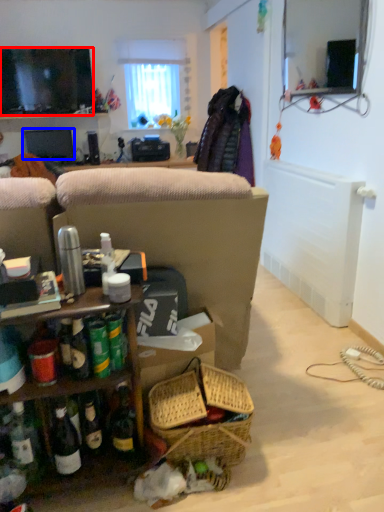
Question: Among these objects, which one is nearest to the camera, television (highlighted by a red box) or television (highlighted by a blue box)?

Choices:
 (A) television
 (B) television

Answer: (A)